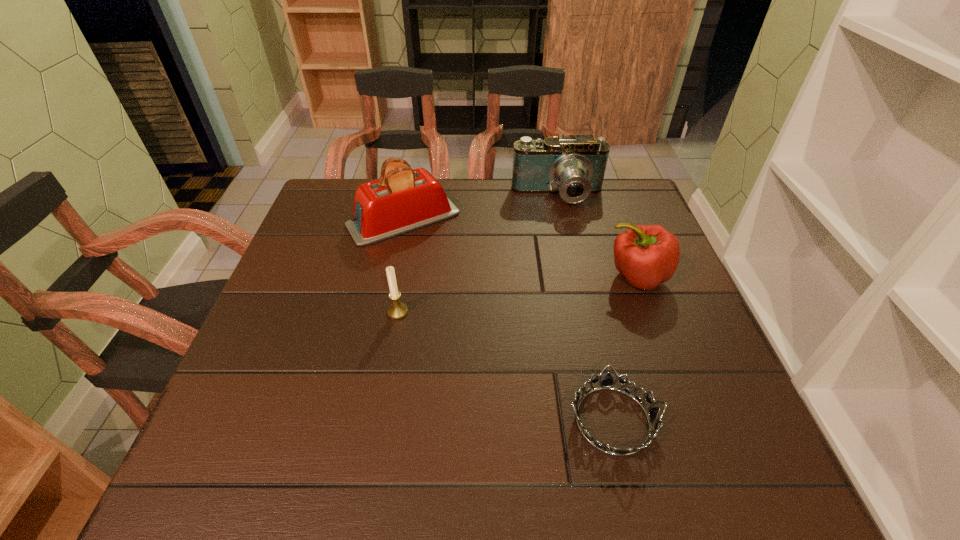
At what (x,y) coordinates should I click in order to perform the action: click on vacant region located 0.360m on the front-facing side of the tiara. Please return your answer as a coordinate pair (x, y). This screenshot has width=960, height=540. Looking at the image, I should click on (366, 420).

You are a GUI agent. You are given a task and a screenshot of the screen. Output one action in this format:
    pyautogui.click(x=<x>, y=<y>)
    Task: Click on the blank space located on the front-facing side of the tiara
    The image size is (960, 540).
    Given the screenshot: What is the action you would take?
    pyautogui.click(x=489, y=420)

Image resolution: width=960 pixels, height=540 pixels. In order to click on blank space located on the front-facing side of the tiara in this screenshot , I will do `click(427, 420)`.

The image size is (960, 540). In order to click on toaster that is positioned at the far edge in this screenshot , I will do `click(402, 199)`.

The image size is (960, 540). Identify the location of camcorder that is at the far edge. (573, 166).

In order to click on object that is positioned at the near edge in this screenshot , I will do `click(607, 383)`.

At what (x,y) coordinates should I click in order to perform the action: click on object present at the left edge. Please return your answer as a coordinate pair (x, y). Looking at the image, I should click on (402, 199).

Locate an element on the screen. camcorder present at the right edge is located at coordinates click(573, 166).

The width and height of the screenshot is (960, 540). What are the coordinates of `bell pepper present at the right edge` in the screenshot? It's located at (646, 255).

Where is `tiara present at the right edge`? The image size is (960, 540). tiara present at the right edge is located at coordinates (607, 383).